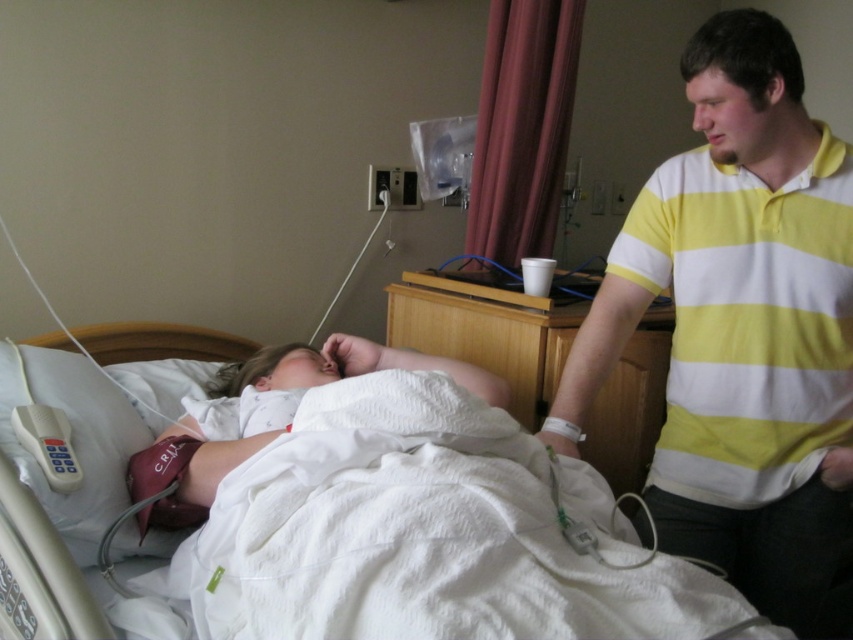
Question: Which object is positioned farthest from the white soft baby at center?

Choices:
 (A) white fabric pillow at lower left
 (B) white plastic remote control at lower left

Answer: (B)

Question: Which point is closer to the camera taking this photo?

Choices:
 (A) (93, 481)
 (B) (236, 577)
 (C) (61, 472)
 (D) (659, 252)

Answer: (B)

Question: Can you confirm if white textured bed at center is thinner than white soft baby at center?

Choices:
 (A) yes
 (B) no

Answer: (B)

Question: Observing the image, what is the correct spatial positioning of white textured bed at center in reference to white fabric pillow at lower left?

Choices:
 (A) above
 (B) below

Answer: (B)

Question: Is white textured bed at center bigger than white fabric pillow at lower left?

Choices:
 (A) yes
 (B) no

Answer: (A)

Question: Which object appears closest to the camera in this image?

Choices:
 (A) white soft baby at center
 (B) yellow striped polo shirt at right

Answer: (B)